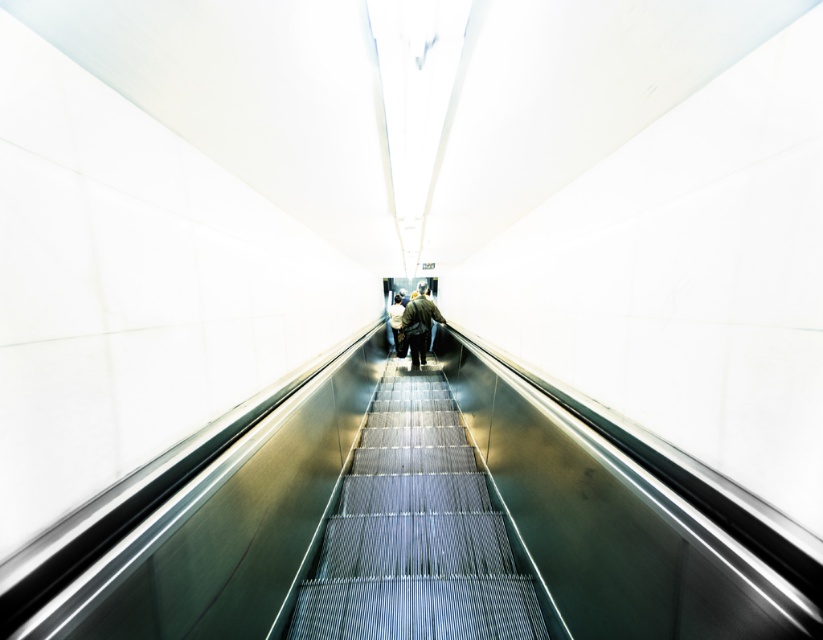
Between point (470, 531) and point (398, 342), which one is positioned behind?

The point (398, 342) is behind.

Is metallic silver stairs at center smaller than green textured jacket at center?

Indeed, metallic silver stairs at center has a smaller size compared to green textured jacket at center.

Is point (346, 508) less distant than point (421, 346)?

That is True.

In order to click on metallic silver stairs at center in this screenshot , I will do `click(415, 532)`.